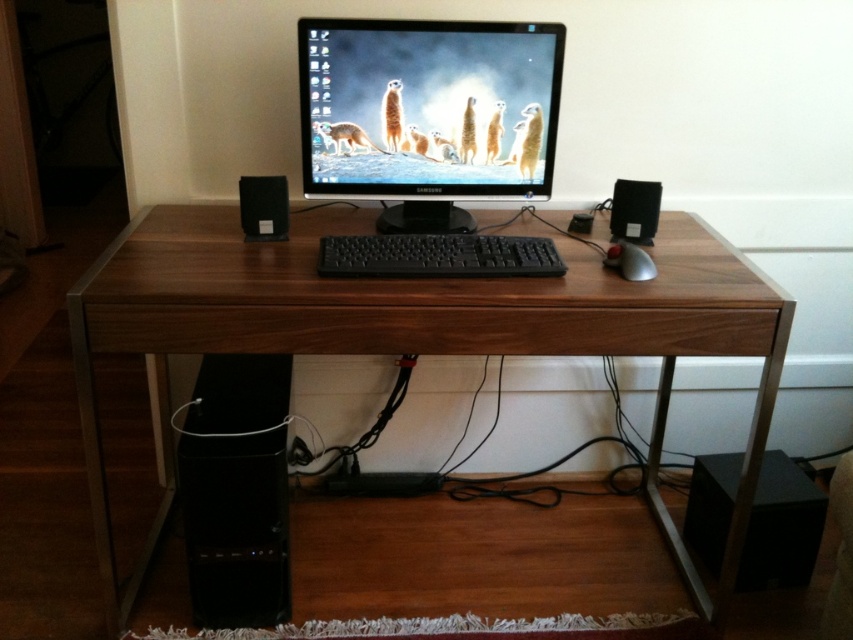
You are standing in front of the desk in the home office. There are two points marked on the desk surface. One is at coordinate point (558, 268) and the other is at point (268, 240). If you want to place a small plant closer to you, which point should you choose?

You should choose point (558, 268) because it is closer to the viewer than point (268, 240).

You are a delivery person who just arrived at the office. You need to place a new wireless mouse on the desk. The mouse has a red scroll wheel and should be placed 10 cm to the right of the black matte keyboard at center. Where should you place the new mouse?

The new wireless mouse with a red scroll wheel should be placed 10 cm to the right of the black matte keyboard at center.

You are setting up a new desk lamp for your home office. The lamp has a base that needs to be placed at the point with coordinates point (426, 106). Where should you place the lamp base?

The point (426, 106) corresponds to the matte black monitor at center, so you should place the lamp base at the matte black monitor at center.